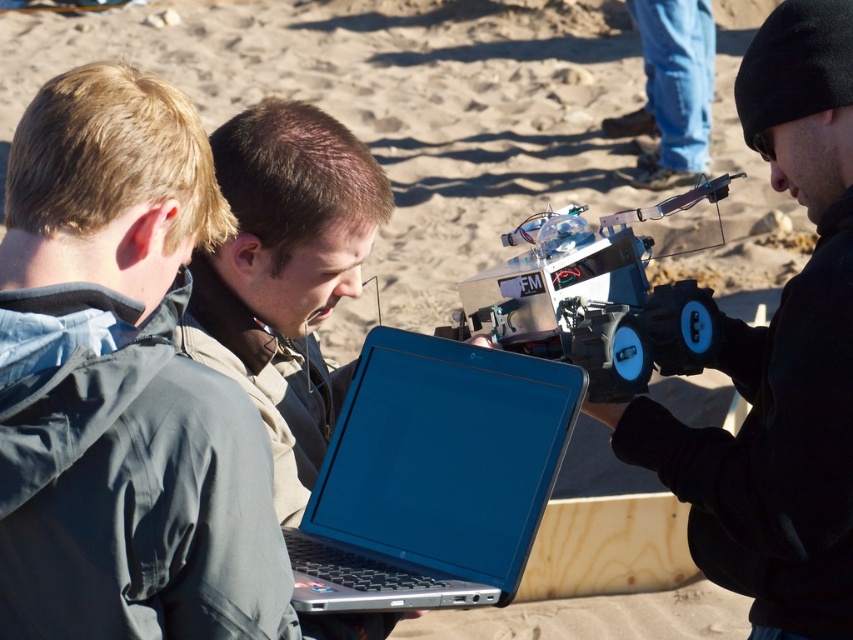
Who is shorter, metallic/plastic robot at center or blue jeans at upper center?

With less height is metallic/plastic robot at center.

Is point (618, 266) positioned behind point (697, 144)?

No, (618, 266) is in front of (697, 144).

The width and height of the screenshot is (853, 640). I want to click on metallic/plastic robot at center, so click(596, 301).

Is gray fabric jacket at center taller than blue jeans at upper center?

Incorrect, gray fabric jacket at center's height is not larger of blue jeans at upper center's.

Is point (219, 614) more distant than point (676, 122)?

No, it is in front of (676, 122).

Does point (207, 422) come in front of point (689, 36)?

Yes, point (207, 422) is closer to viewer.

The image size is (853, 640). I want to click on gray fabric jacket at center, so click(122, 385).

Is black matte robot at center shorter than metallic/plastic robot at center?

In fact, black matte robot at center may be taller than metallic/plastic robot at center.

Does black matte robot at center have a smaller size compared to metallic/plastic robot at center?

No, black matte robot at center is not smaller than metallic/plastic robot at center.

This screenshot has width=853, height=640. What do you see at coordinates (779, 358) in the screenshot? I see `black matte robot at center` at bounding box center [779, 358].

Where is `black matte robot at center`? This screenshot has width=853, height=640. black matte robot at center is located at coordinates [x=779, y=358].